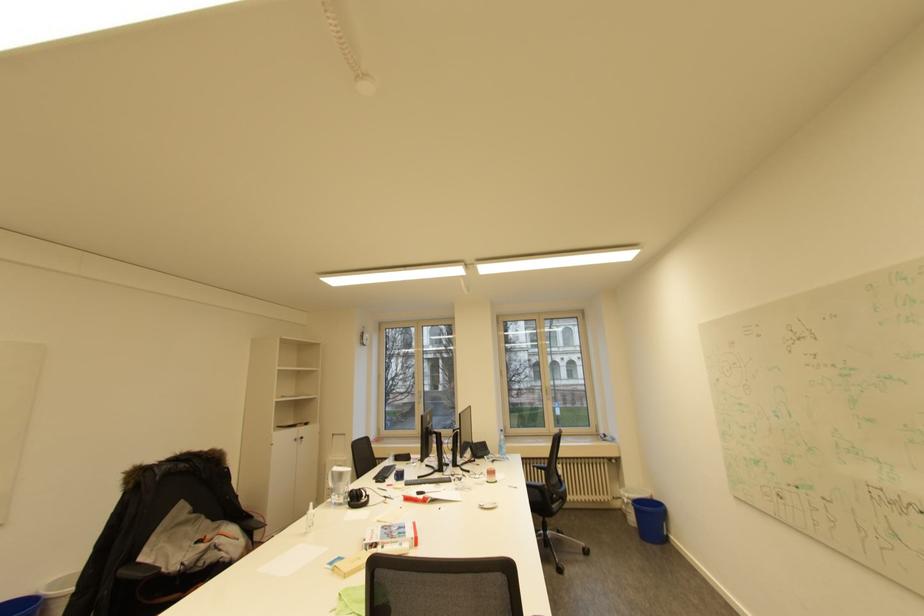
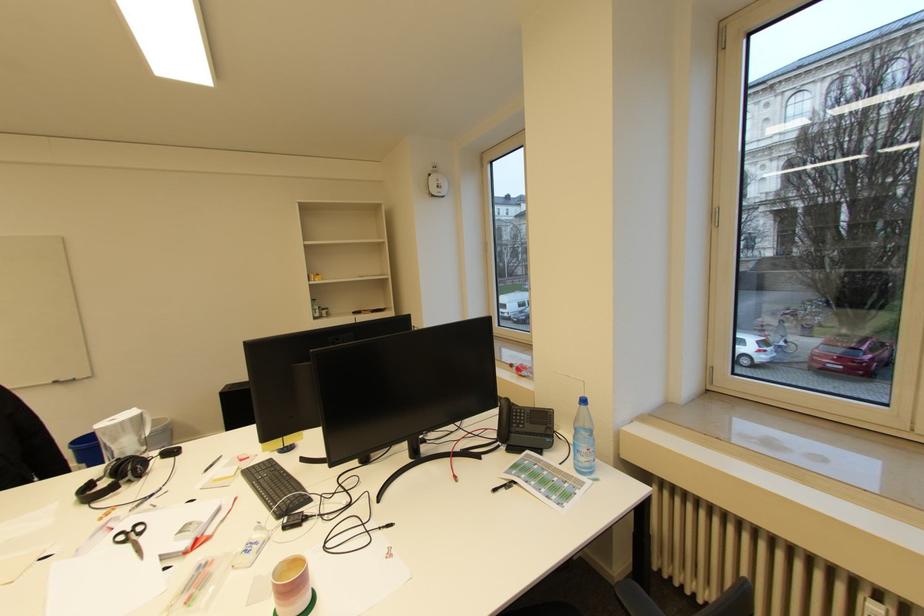
In the second image, find the point that corresponds to [506,440] in the first image.

(581, 429)